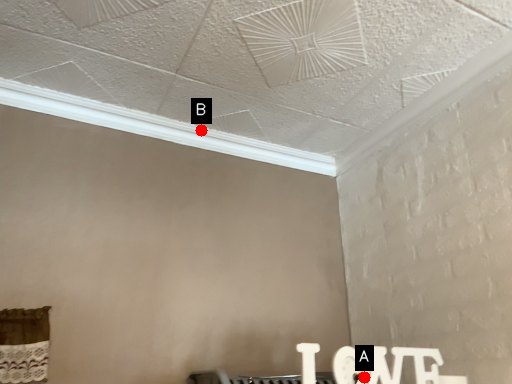
Question: Two points are circled on the image, labeled by A and B beside each circle. Which point is farther from the camera taking this photo?

Choices:
 (A) A is further
 (B) B is further

Answer: (B)